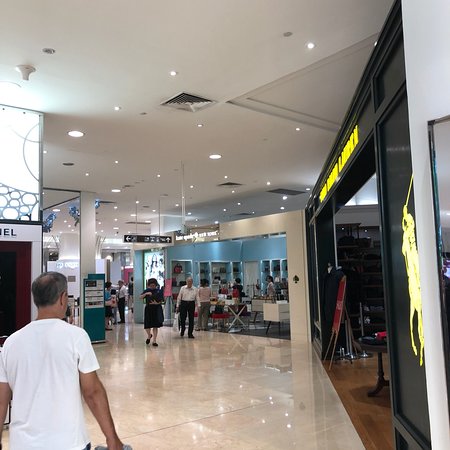
The width and height of the screenshot is (450, 450). Find the location of `floor`. floor is located at coordinates (230, 396).